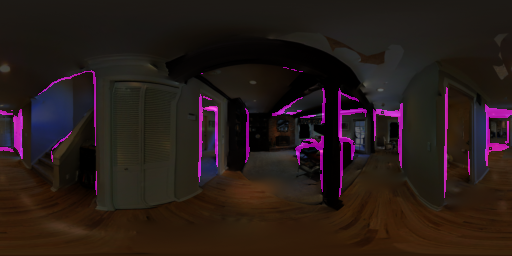
Identify the location of door. Image resolution: width=512 pixels, height=256 pixels. (359, 135).